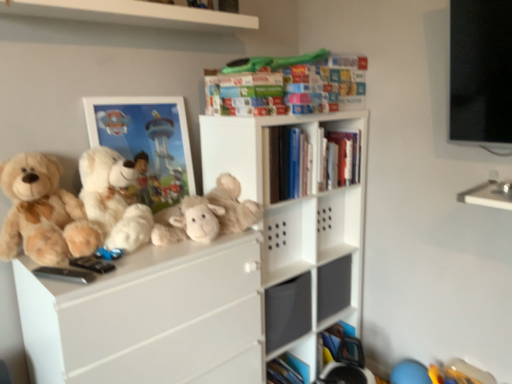
Question: Is fluffy beige stuffed animal at center surrounding multicolored cardboard book at upper center, which appears as the second book when ordered from the bottom?

Choices:
 (A) yes
 (B) no

Answer: (B)

Question: Is fluffy beige stuffed animal at center bigger than multicolored cardboard book at upper center, which is counted as the 1th book, starting from the top?

Choices:
 (A) yes
 (B) no

Answer: (A)

Question: From a real-world perspective, does fluffy beige stuffed animal at center stand above multicolored cardboard book at upper center, which appears as the second book when ordered from the bottom?

Choices:
 (A) yes
 (B) no

Answer: (B)

Question: From the image's perspective, is fluffy beige stuffed animal at center located beneath multicolored cardboard book at upper center, which appears as the second book when ordered from the bottom?

Choices:
 (A) no
 (B) yes

Answer: (B)

Question: Is fluffy beige stuffed animal at center thinner than multicolored cardboard book at upper center, which appears as the second book when ordered from the bottom?

Choices:
 (A) no
 (B) yes

Answer: (A)

Question: In terms of height, does hardcover books at center, acting as the second book starting from the top, look taller or shorter compared to fluffy beige stuffed animal at center?

Choices:
 (A) short
 (B) tall

Answer: (B)

Question: Relative to fluffy beige stuffed animal at center, is hardcover books at center, which is the 1th book from bottom to top, in front or behind?

Choices:
 (A) front
 (B) behind

Answer: (B)

Question: Considering the relative positions of hardcover books at center, which is the 1th book from bottom to top, and fluffy beige stuffed animal at center in the image provided, is hardcover books at center, which is the 1th book from bottom to top, to the left or to the right of fluffy beige stuffed animal at center?

Choices:
 (A) right
 (B) left

Answer: (A)

Question: Is hardcover books at center, acting as the second book starting from the top, inside the boundaries of fluffy beige stuffed animal at center, or outside?

Choices:
 (A) inside
 (B) outside

Answer: (B)

Question: Is soft beige teddy bear at left, which ranks as the 2th teddy bear in right-to-left order, bigger or smaller than hardcover books at center, which is the 1th book from bottom to top?

Choices:
 (A) small
 (B) big

Answer: (A)

Question: Relative to hardcover books at center, acting as the second book starting from the top, is soft beige teddy bear at left, which is the first teddy bear from left to right, in front or behind?

Choices:
 (A) behind
 (B) front

Answer: (B)

Question: Does point (69, 243) appear closer or farther from the camera than point (285, 188)?

Choices:
 (A) farther
 (B) closer

Answer: (B)

Question: Considering the relative positions of soft beige teddy bear at left, which ranks as the 2th teddy bear in right-to-left order, and hardcover books at center, which is the 1th book from bottom to top, in the image provided, is soft beige teddy bear at left, which ranks as the 2th teddy bear in right-to-left order, to the left or to the right of hardcover books at center, which is the 1th book from bottom to top,?

Choices:
 (A) left
 (B) right

Answer: (A)

Question: From a real-world perspective, relative to white plush teddy bear at left, which is counted as the 1th teddy bear, starting from the right, is soft beige teddy bear at left, which is the first teddy bear from left to right, vertically above or below?

Choices:
 (A) below
 (B) above

Answer: (A)

Question: Is point (23, 230) positioned closer to the camera than point (138, 231)?

Choices:
 (A) closer
 (B) farther

Answer: (A)